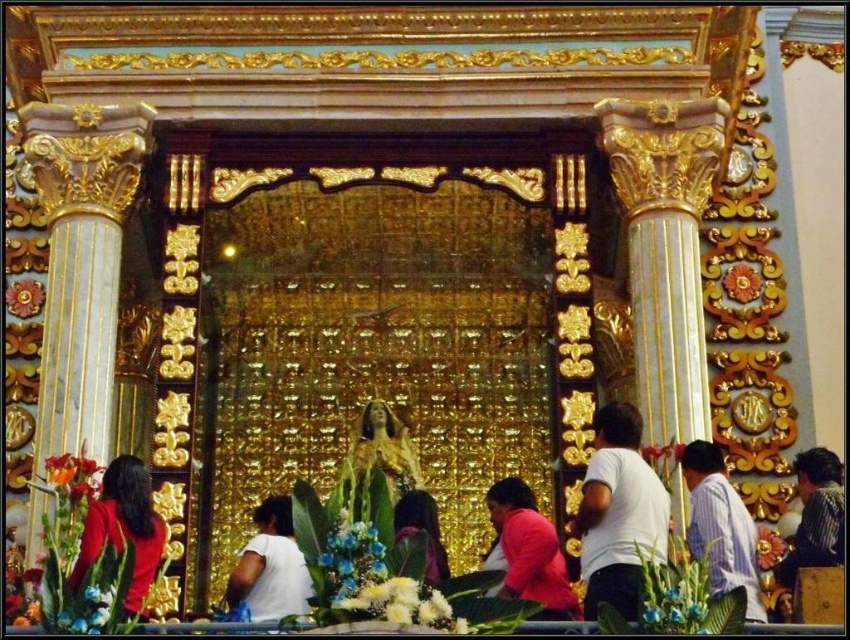
This screenshot has width=850, height=640. What do you see at coordinates (618, 513) in the screenshot?
I see `white matte shirt at center` at bounding box center [618, 513].

Who is taller, white matte shirt at center or dark hair at center?

white matte shirt at center is taller.

Who is more distant from viewer, (585, 576) or (425, 566)?

Point (585, 576)

Image resolution: width=850 pixels, height=640 pixels. What are the coordinates of `white matte shirt at center` in the screenshot? It's located at (618, 513).

Find the location of `gold leaf statue at center`. gold leaf statue at center is located at coordinates (382, 451).

What do you see at coordinates (382, 451) in the screenshot?
I see `gold leaf statue at center` at bounding box center [382, 451].

The image size is (850, 640). I want to click on gold leaf statue at center, so click(x=382, y=451).

Which is more to the right, white matte shirt at center or striped fabric shirt at right?

striped fabric shirt at right is more to the right.

You are a GUI agent. You are given a task and a screenshot of the screen. Output one action in this format:
    pyautogui.click(x=<x>, y=<y>)
    Task: Click on the white matte shirt at center
    Image resolution: width=850 pixels, height=640 pixels.
    Given the screenshot: What is the action you would take?
    pyautogui.click(x=618, y=513)